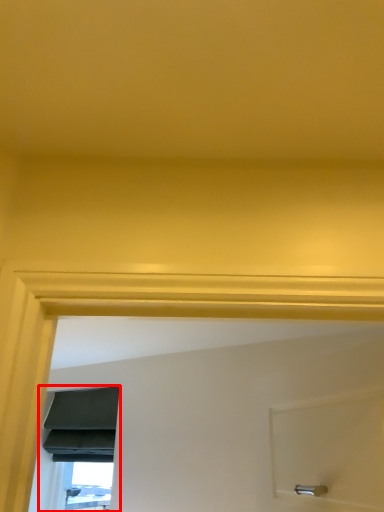
Question: From the image's perspective, where is window (annotated by the red box) located relative to window?

Choices:
 (A) above
 (B) below

Answer: (A)